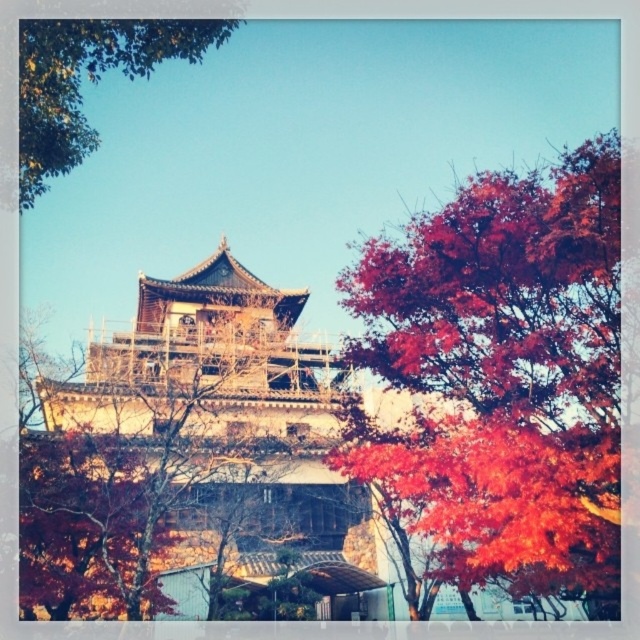
Does vivid crimson leaves at right appear under green leafy tree at upper left?

Yes.

Between vivid crimson leaves at right and green leafy tree at upper left, which one is positioned higher?

green leafy tree at upper left is higher up.

Between point (589, 356) and point (67, 136), which one is positioned in front?

Point (67, 136)

Identify the location of vivid crimson leaves at right. (502, 376).